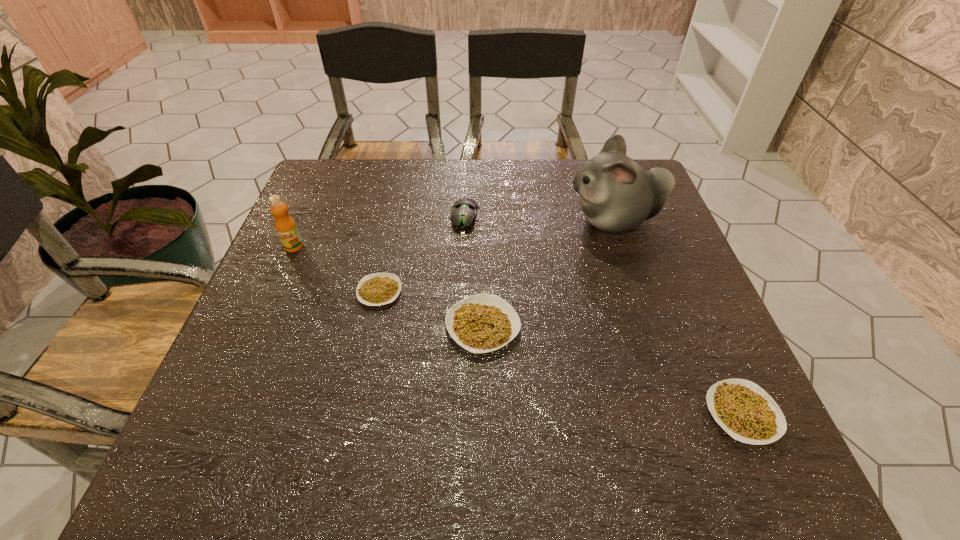
Where is `the leftmost legume`? This screenshot has height=540, width=960. the leftmost legume is located at coordinates (376, 289).

This screenshot has height=540, width=960. I want to click on the shortest legume, so click(x=376, y=289).

What are the coordinates of `the second legume from right to left` in the screenshot? It's located at (481, 323).

I want to click on the fifth tallest object, so click(743, 409).

Where is `the nearest object`? The width and height of the screenshot is (960, 540). the nearest object is located at coordinates (743, 409).

I want to click on hamster, so click(x=617, y=194).

Where is `the leftmost object`? This screenshot has width=960, height=540. the leftmost object is located at coordinates (286, 228).

At what (x,y) coordinates should I click in order to perform the action: click on the second tallest object. Please return your answer as a coordinate pair (x, y). Image resolution: width=960 pixels, height=540 pixels. Looking at the image, I should click on (286, 228).

Identify the location of computer mouse. (464, 211).

Find the location of a particular element. The width and height of the screenshot is (960, 540). free space located 0.140m on the back of the shortest legume is located at coordinates (392, 235).